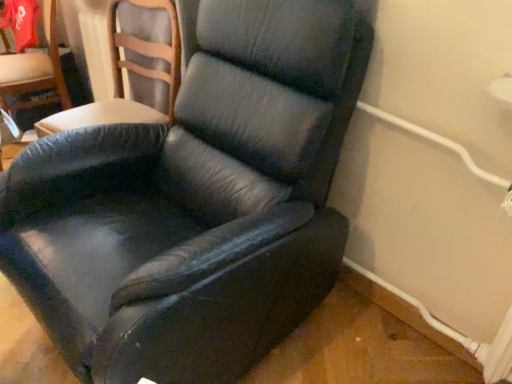
This screenshot has height=384, width=512. What do you see at coordinates (122, 78) in the screenshot?
I see `black leather chair at center, the 2th chair viewed from the right` at bounding box center [122, 78].

I want to click on black leather chair at center, the 2th chair viewed from the right, so click(x=122, y=78).

The height and width of the screenshot is (384, 512). What are the coordinates of `black leather chair at center, which ranks as the 2th chair in left-to-right order` in the screenshot? It's located at (195, 203).

The image size is (512, 384). Describe the element at coordinates (195, 203) in the screenshot. I see `black leather chair at center, positioned as the 1th chair in right-to-left order` at that location.

Locate an element on the screen. black leather chair at center, acting as the 1th chair starting from the left is located at coordinates (122, 78).

Considering the relative positions of black leather chair at center, acting as the 1th chair starting from the left, and black leather chair at center, which ranks as the 2th chair in left-to-right order, in the image provided, is black leather chair at center, acting as the 1th chair starting from the left, to the left or to the right of black leather chair at center, which ranks as the 2th chair in left-to-right order,?

In the image, black leather chair at center, acting as the 1th chair starting from the left, appears on the left side of black leather chair at center, which ranks as the 2th chair in left-to-right order.

Which object is closer to the camera taking this photo, black leather chair at center, acting as the 1th chair starting from the left, or black leather chair at center, positioned as the 1th chair in right-to-left order?

black leather chair at center, positioned as the 1th chair in right-to-left order.

Is point (177, 56) positioned behind point (153, 203)?

Yes, point (177, 56) is behind point (153, 203).

From the image's perspective, would you say black leather chair at center, acting as the 1th chair starting from the left, is positioned over black leather chair at center, positioned as the 1th chair in right-to-left order?

Yes, from the image's perspective, black leather chair at center, acting as the 1th chair starting from the left, is over black leather chair at center, positioned as the 1th chair in right-to-left order.

From a real-world perspective, which object stands above the other?

black leather chair at center, the 2th chair viewed from the right.

Looking at this image, does black leather chair at center, the 2th chair viewed from the right, have a lesser width compared to black leather chair at center, positioned as the 1th chair in right-to-left order?

Correct, the width of black leather chair at center, the 2th chair viewed from the right, is less than that of black leather chair at center, positioned as the 1th chair in right-to-left order.

Based on the photo, who is shorter, black leather chair at center, the 2th chair viewed from the right, or black leather chair at center, which ranks as the 2th chair in left-to-right order?

With less height is black leather chair at center, the 2th chair viewed from the right.

Looking at the image, does black leather chair at center, the 2th chair viewed from the right, seem bigger or smaller compared to black leather chair at center, which ranks as the 2th chair in left-to-right order?

In the image, black leather chair at center, the 2th chair viewed from the right, appears to be smaller than black leather chair at center, which ranks as the 2th chair in left-to-right order.

Would you say black leather chair at center, the 2th chair viewed from the right, is outside black leather chair at center, positioned as the 1th chair in right-to-left order?

black leather chair at center, the 2th chair viewed from the right, lies outside black leather chair at center, positioned as the 1th chair in right-to-left order,'s area.

Can you see black leather chair at center, the 2th chair viewed from the right, touching black leather chair at center, positioned as the 1th chair in right-to-left order?

No, black leather chair at center, the 2th chair viewed from the right, is not in contact with black leather chair at center, positioned as the 1th chair in right-to-left order.

Is black leather chair at center, which ranks as the 2th chair in left-to-right order, at the back of black leather chair at center, the 2th chair viewed from the right?

That's not correct — black leather chair at center, the 2th chair viewed from the right, is not looking away from black leather chair at center, which ranks as the 2th chair in left-to-right order.

Can you tell me how much black leather chair at center, acting as the 1th chair starting from the left, and black leather chair at center, positioned as the 1th chair in right-to-left order, differ in facing direction?

The angular difference between black leather chair at center, acting as the 1th chair starting from the left, and black leather chair at center, positioned as the 1th chair in right-to-left order, is 3.94 degrees.

How distant is black leather chair at center, acting as the 1th chair starting from the left, from black leather chair at center, which ranks as the 2th chair in left-to-right order?

19.29 inches.

The width and height of the screenshot is (512, 384). I want to click on chair below the black leather chair at center, acting as the 1th chair starting from the left (from a real-world perspective), so click(195, 203).

Which is more to the right, black leather chair at center, positioned as the 1th chair in right-to-left order, or black leather chair at center, acting as the 1th chair starting from the left?

From the viewer's perspective, black leather chair at center, positioned as the 1th chair in right-to-left order, appears more on the right side.

Which is in front, black leather chair at center, positioned as the 1th chair in right-to-left order, or black leather chair at center, acting as the 1th chair starting from the left?

black leather chair at center, positioned as the 1th chair in right-to-left order, is more forward.

Which is in front, point (106, 324) or point (168, 73)?

Positioned in front is point (106, 324).

From the picture: From the image's perspective, is black leather chair at center, positioned as the 1th chair in right-to-left order, located above black leather chair at center, the 2th chair viewed from the right?

Incorrect, from the image's perspective, black leather chair at center, positioned as the 1th chair in right-to-left order, is lower than black leather chair at center, the 2th chair viewed from the right.

From a real-world perspective, is black leather chair at center, positioned as the 1th chair in right-to-left order, physically located above or below black leather chair at center, the 2th chair viewed from the right?

Clearly, from a real-world perspective, black leather chair at center, positioned as the 1th chair in right-to-left order, is below black leather chair at center, the 2th chair viewed from the right.

Can you confirm if black leather chair at center, positioned as the 1th chair in right-to-left order, is wider than black leather chair at center, the 2th chair viewed from the right?

Yes.

From their relative heights in the image, would you say black leather chair at center, positioned as the 1th chair in right-to-left order, is taller or shorter than black leather chair at center, acting as the 1th chair starting from the left?

Clearly, black leather chair at center, positioned as the 1th chair in right-to-left order, is taller compared to black leather chair at center, acting as the 1th chair starting from the left.

Is black leather chair at center, positioned as the 1th chair in right-to-left order, smaller than black leather chair at center, the 2th chair viewed from the right?

No, black leather chair at center, positioned as the 1th chair in right-to-left order, is not smaller than black leather chair at center, the 2th chair viewed from the right.

Is black leather chair at center, positioned as the 1th chair in right-to-left order, surrounding black leather chair at center, the 2th chair viewed from the right?

No, black leather chair at center, the 2th chair viewed from the right, is not surrounded by black leather chair at center, positioned as the 1th chair in right-to-left order.

Is black leather chair at center, which ranks as the 2th chair in left-to-right order, beside black leather chair at center, acting as the 1th chair starting from the left?

black leather chair at center, which ranks as the 2th chair in left-to-right order, is not next to black leather chair at center, acting as the 1th chair starting from the left, and they're not touching.

In the scene shown: Could you tell me if black leather chair at center, positioned as the 1th chair in right-to-left order, is turned towards black leather chair at center, the 2th chair viewed from the right?

No.

Can you tell me how much black leather chair at center, which ranks as the 2th chair in left-to-right order, and black leather chair at center, the 2th chair viewed from the right, differ in facing direction?

3.94 degrees separate the facing orientations of black leather chair at center, which ranks as the 2th chair in left-to-right order, and black leather chair at center, the 2th chair viewed from the right.

Measure the distance between black leather chair at center, positioned as the 1th chair in right-to-left order, and black leather chair at center, acting as the 1th chair starting from the left.

49.00 centimeters.

The width and height of the screenshot is (512, 384). Find the location of `chair that is above the black leather chair at center, positioned as the 1th chair in right-to-left order (from the image's perspective)`. chair that is above the black leather chair at center, positioned as the 1th chair in right-to-left order (from the image's perspective) is located at coordinates (122, 78).

Where is `chair lying behind the black leather chair at center, positioned as the 1th chair in right-to-left order`? The width and height of the screenshot is (512, 384). chair lying behind the black leather chair at center, positioned as the 1th chair in right-to-left order is located at coordinates (122, 78).

This screenshot has height=384, width=512. I want to click on chair above the black leather chair at center, positioned as the 1th chair in right-to-left order (from a real-world perspective), so click(x=122, y=78).